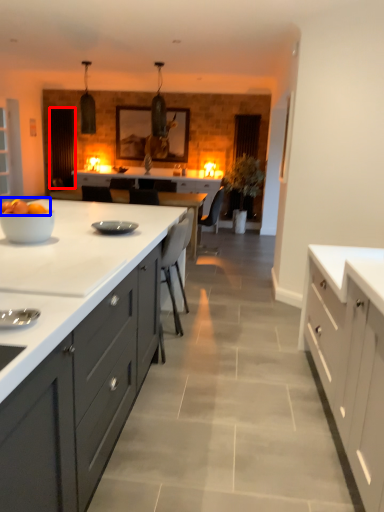
Question: Which point is further to the camera, glass door (highlighted by a red box) or fruit (highlighted by a blue box)?

Choices:
 (A) glass door
 (B) fruit

Answer: (A)